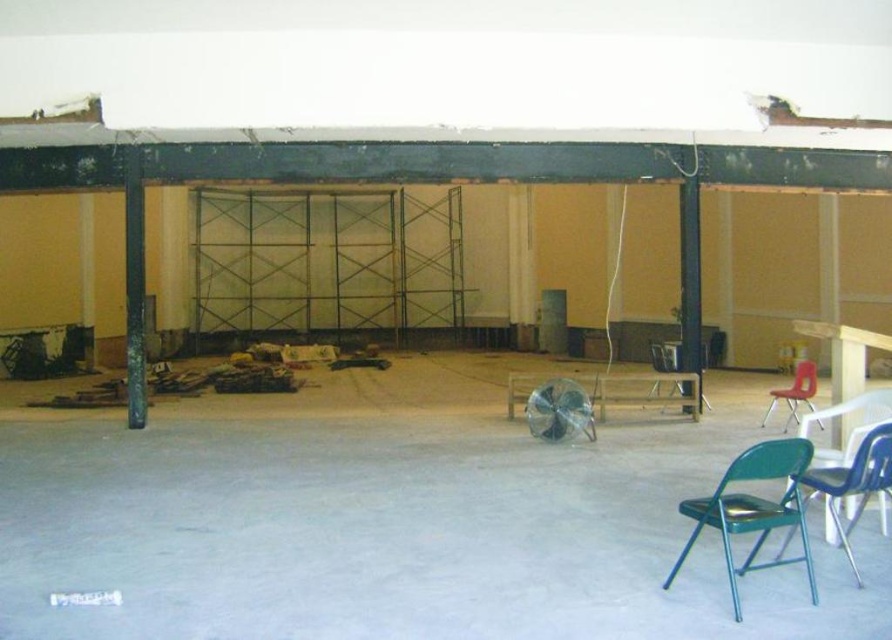
Who is positioned more to the left, matte plastic chair at right or metallic silver chair at center?

metallic silver chair at center is more to the left.

How far apart are matte plastic chair at right and metallic silver chair at center?

2.90 meters

The height and width of the screenshot is (640, 892). Identify the location of matte plastic chair at right. (794, 392).

At what (x,y) coordinates should I click in order to perform the action: click on matte plastic chair at right. Please return your answer as a coordinate pair (x, y). The width and height of the screenshot is (892, 640). Looking at the image, I should click on (794, 392).

Can you confirm if metallic blue chair at lower right is wider than matte plastic chair at right?

Yes, metallic blue chair at lower right is wider than matte plastic chair at right.

Image resolution: width=892 pixels, height=640 pixels. Identify the location of metallic blue chair at lower right. (853, 483).

Find the location of a particular element. metallic blue chair at lower right is located at coordinates (853, 483).

Who is taller, metallic blue chair at lower right or metallic silver chair at center?

With more height is metallic silver chair at center.

Which is above, metallic blue chair at lower right or metallic silver chair at center?

metallic silver chair at center

Between point (880, 492) and point (665, 360), which one is positioned behind?

Point (665, 360)

Image resolution: width=892 pixels, height=640 pixels. What are the coordinates of `metallic blue chair at lower right` in the screenshot? It's located at (853, 483).